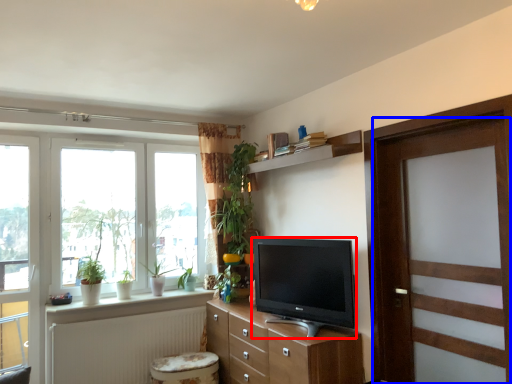
Question: Which object appears closest to the camera in this image, television (highlighted by a red box) or door (highlighted by a blue box)?

Choices:
 (A) television
 (B) door

Answer: (B)